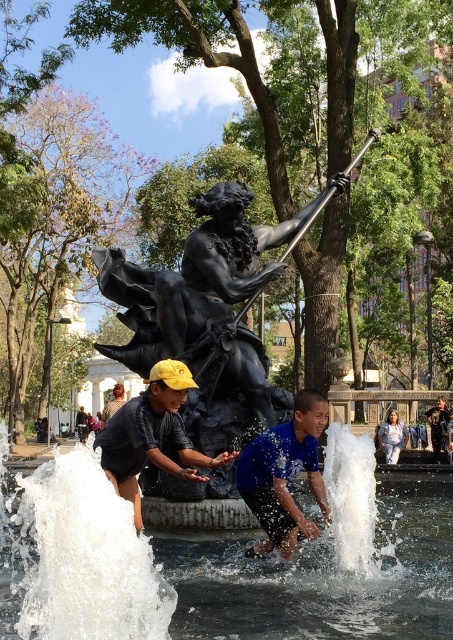
You are designing a new park layout and need to place a bench between the black polished statue at center and the matte black statue at center. Which statue should the bench be closer to if you want the bench to be near the wider statue?

The bench should be placed closer to the black polished statue at center because its width is larger than the matte black statue at center.

You are a photographer trying to capture a shot of both the clear water at fountain center and the black polished statue at center. Based on their positions, which object should you focus on first if you want to include both in your frame without moving the camera?

The clear water at fountain center is to the right of the black polished statue at center, so you should focus on the black polished statue at center first to ensure both are in the frame without moving the camera.

You are a visitor at the park and you want to take a photo of the black polished statue at center and the matte black statue at center. Which one is higher up?

The black polished statue at center is positioned over the matte black statue at center, so the black polished statue at center is higher up.